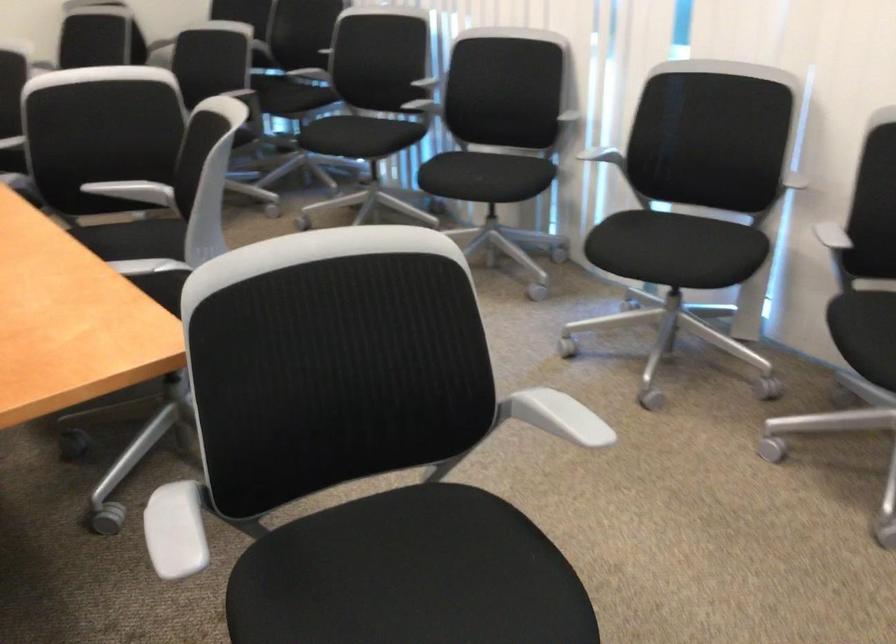
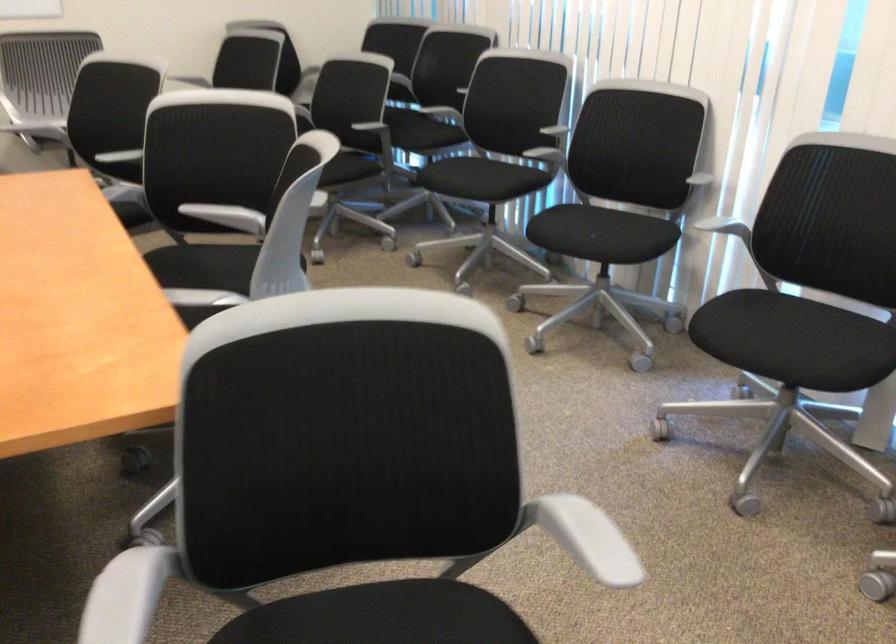
Question: The camera is either moving clockwise (left) or counter-clockwise (right) around the object. The first image is from the beginning of the video and the second image is from the end. Is the camera moving left or right when shooting the video?

Choices:
 (A) Left
 (B) Right

Answer: (B)